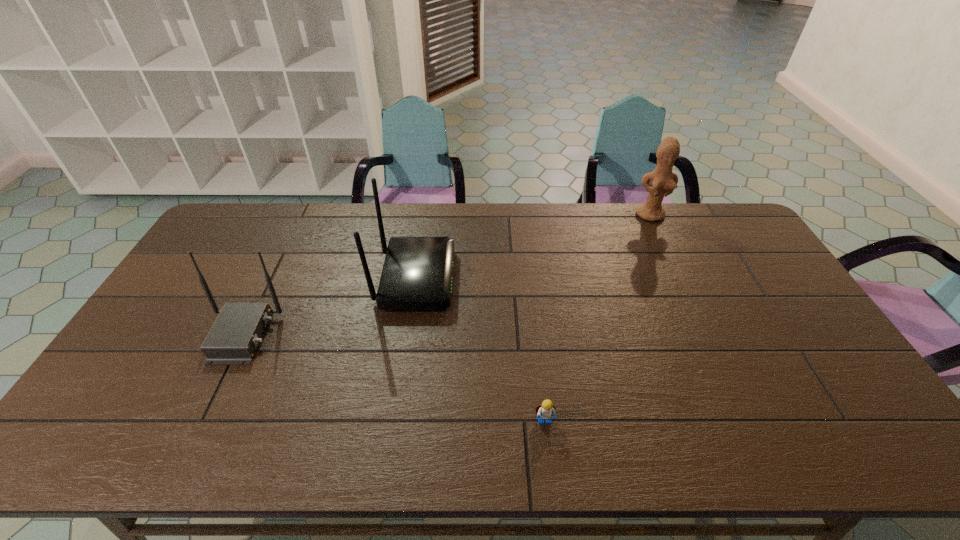
The width and height of the screenshot is (960, 540). Find the location of `free point between the shorter router and the right router`. free point between the shorter router and the right router is located at coordinates (329, 307).

Where is `vacant area that lies between the third object from right to left and the farthest object`? vacant area that lies between the third object from right to left and the farthest object is located at coordinates (533, 247).

Identify the location of free space between the right router and the nearest object. The image size is (960, 540). (480, 350).

The height and width of the screenshot is (540, 960). I want to click on vacant area that lies between the farthest object and the nearest object, so click(x=597, y=318).

Find the location of a particular element. the closest object relative to the right router is located at coordinates (234, 337).

Locate which object is the closest to the right router. Please provide its 2D coordinates. Your answer should be formatted as a tuple, i.e. [(x, y)], where the tuple contains the x and y coordinates of a point satisfying the conditions above.

[(234, 337)]

Locate an element on the screen. Image resolution: width=960 pixels, height=540 pixels. free space that satisfies the following two spatial constraints: 1. on the front-facing side of the figurine; 2. on the front-facing side of the right router is located at coordinates (681, 279).

You are a GUI agent. You are given a task and a screenshot of the screen. Output one action in this format:
    pyautogui.click(x=<x>, y=<y>)
    Task: Click on the vacant space that satisfies the following two spatial constraints: 1. on the front-facing side of the figurine; 2. on the front-facing side of the taller router
    The height and width of the screenshot is (540, 960).
    Given the screenshot: What is the action you would take?
    pos(681,279)

Where is `free space that satisfies the following two spatial constraints: 1. on the front-facing side of the farthest object; 2. on the front-facing side of the right router`? This screenshot has width=960, height=540. free space that satisfies the following two spatial constraints: 1. on the front-facing side of the farthest object; 2. on the front-facing side of the right router is located at coordinates (681, 279).

Identify the location of vacant space that satisfies the following two spatial constraints: 1. on the front-facing side of the figurine; 2. on the back of the left router to connect cables. The image size is (960, 540). (707, 335).